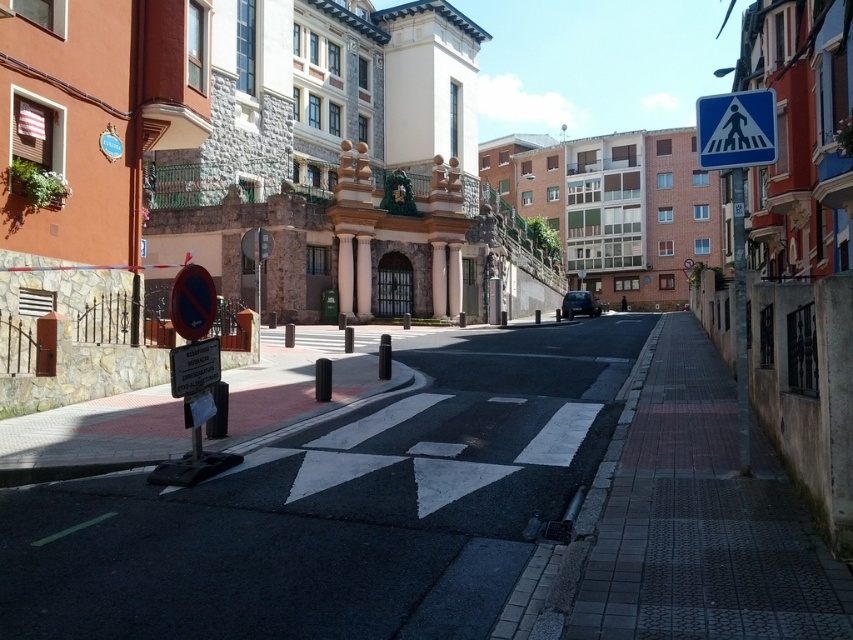
Question: Is white plastic pedestrian crossing sign at upper right behind dark gray metallic car at center?

Choices:
 (A) yes
 (B) no

Answer: (B)

Question: Is white plastic pedestrian crossing sign at upper right below dark gray metallic car at center?

Choices:
 (A) no
 (B) yes

Answer: (A)

Question: Which point is farther from the camera taking this photo?

Choices:
 (A) (592, 305)
 (B) (737, 141)

Answer: (A)

Question: Which point is farther from the camera taking this photo?

Choices:
 (A) (744, 108)
 (B) (579, 294)

Answer: (B)

Question: Can you confirm if white plastic pedestrian crossing sign at upper right is thinner than dark gray metallic car at center?

Choices:
 (A) no
 (B) yes

Answer: (A)